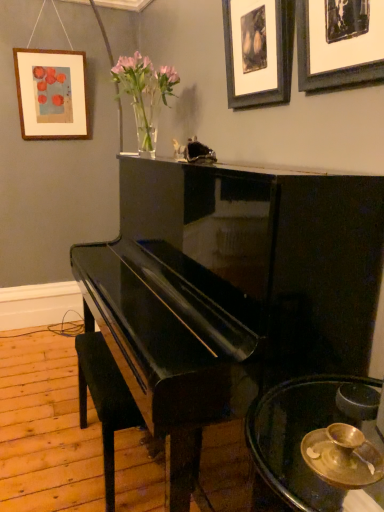
What is the approximate height of translucent glass vase at upper center?

It is 17.48 inches.

Locate an element on the screen. This screenshot has width=384, height=512. black leather music stool at lower left is located at coordinates (105, 400).

How different are the orientations of wooden picture frame at upper center, the 2th picture frame in the front-to-back sequence, and glossy black piano at center in degrees?

0.284 degrees separate the facing orientations of wooden picture frame at upper center, the 2th picture frame in the front-to-back sequence, and glossy black piano at center.

Does wooden picture frame at upper center, which is the 2th picture frame from left to right, turn towards glossy black piano at center?

No, wooden picture frame at upper center, which is the 2th picture frame from left to right, is not facing towards glossy black piano at center.

Is point (283, 42) positioned before point (181, 256)?

Yes, it is in front of point (181, 256).

Is glossy black piano at center located within wooden picture frame at upper center, the 2th picture frame in the front-to-back sequence?

Definitely not — glossy black piano at center is not inside wooden picture frame at upper center, the 2th picture frame in the front-to-back sequence.

Can you confirm if black leather music stool at lower left is smaller than gold metallic bowl at lower right?

No.

From the image's perspective, is black leather music stool at lower left on top of gold metallic bowl at lower right?

Actually, black leather music stool at lower left appears below gold metallic bowl at lower right in the image.

Find the location of a particular element. Image resolution: width=384 pixels, height=512 pixels. table above the black leather music stool at lower left (from the image's perspective) is located at coordinates (301, 438).

Can you confirm if black leather music stool at lower left is shorter than gold metallic bowl at lower right?

No.

In the scene shown: Is black leather music stool at lower left shorter than glossy black piano at center?

Yes, black leather music stool at lower left is shorter than glossy black piano at center.

Is black leather music stool at lower left facing towards glossy black piano at center?

Yes, black leather music stool at lower left is facing glossy black piano at center.

Looking at this image, can you tell me how much black leather music stool at lower left and glossy black piano at center differ in facing direction?

They differ by 0.214 degrees in their facing directions.

Which of these two, wooden picture frame at upper center, which is the 2th picture frame from back to front, or black leather music stool at lower left, is bigger?

black leather music stool at lower left is bigger.

You are a GUI agent. You are given a task and a screenshot of the screen. Output one action in this format:
    pyautogui.click(x=<x>, y=<y>)
    Task: Click on the music stool that appears below the wooden picture frame at upper center, which is the 2th picture frame from left to right (from the image's perspective)
    Image resolution: width=384 pixels, height=512 pixels.
    Given the screenshot: What is the action you would take?
    pyautogui.click(x=105, y=400)

Is black leather music stool at lower left located within wooden picture frame at upper center, which is the 2th picture frame from left to right?

No, black leather music stool at lower left is not a part of wooden picture frame at upper center, which is the 2th picture frame from left to right.

How different are the orientations of wooden picture frame at upper center, which is the 2th picture frame from back to front, and black leather music stool at lower left in degrees?

They differ by 0.0702 degrees in their facing directions.

From a real-world perspective, which object stands above the other?

In real-world perspective, translucent glass vase at upper center is above.

Find the location of a particular element. The image size is (384, 512). floral arrangement lying above the black leather music stool at lower left (from the image's perspective) is located at coordinates (145, 94).

Does translucent glass vase at upper center have a larger size compared to black leather music stool at lower left?

Incorrect, translucent glass vase at upper center is not larger than black leather music stool at lower left.

Is glossy black piano at center to the right of black matte picture frame at upper right, which is the 3th picture frame in back-to-front order, from the viewer's perspective?

In fact, glossy black piano at center is to the left of black matte picture frame at upper right, which is the 3th picture frame in back-to-front order.

Is glossy black piano at center next to black matte picture frame at upper right, which is the 3th picture frame in back-to-front order?

There is a gap between glossy black piano at center and black matte picture frame at upper right, which is the 3th picture frame in back-to-front order.

Locate an element on the screen. picture frame that is the 1st one when counting upward from the glossy black piano at center (from the image's perspective) is located at coordinates (339, 42).

Is glossy black piano at center oriented away from black matte picture frame at upper right, which is the 3th picture frame in back-to-front order?

That's not correct — glossy black piano at center is not looking away from black matte picture frame at upper right, which is the 3th picture frame in back-to-front order.

From the image's perspective, is black matte picture frame at upper right, the first picture frame when ordered from right to left, beneath gold metallic bowl at lower right?

Actually, black matte picture frame at upper right, the first picture frame when ordered from right to left, appears above gold metallic bowl at lower right in the image.

In the scene shown: Considering the relative sizes of black matte picture frame at upper right, which ranks as the 1th picture frame in front-to-back order, and gold metallic bowl at lower right in the image provided, is black matte picture frame at upper right, which ranks as the 1th picture frame in front-to-back order, wider than gold metallic bowl at lower right?

Incorrect, the width of black matte picture frame at upper right, which ranks as the 1th picture frame in front-to-back order, does not surpass that of gold metallic bowl at lower right.

From the picture: Measure the distance from black matte picture frame at upper right, which is the 3th picture frame in back-to-front order, to gold metallic bowl at lower right.

black matte picture frame at upper right, which is the 3th picture frame in back-to-front order, is 35.36 inches from gold metallic bowl at lower right.

Is black matte picture frame at upper right, which is the 3th picture frame in back-to-front order, not near gold metallic bowl at lower right?

No, black matte picture frame at upper right, which is the 3th picture frame in back-to-front order, is not far away from gold metallic bowl at lower right.

I want to click on the 1st picture frame counting from the right of the glossy black piano at center, so click(x=258, y=51).

I want to click on music stool located on the left of gold metallic bowl at lower right, so click(x=105, y=400).

Estimate the real-world distances between objects in this image. Which object is further from wooden picture frame at upper center, the 2th picture frame in the front-to-back sequence, black matte picture frame at upper right, which appears as the 3th picture frame when viewed from the left, or black leather music stool at lower left?

Based on the image, black leather music stool at lower left appears to be further to wooden picture frame at upper center, the 2th picture frame in the front-to-back sequence.

Looking at the image, which one is located further to black leather music stool at lower left, black matte picture frame at upper right, which is the 3th picture frame in back-to-front order, or gold metallic bowl at lower right?

The object further to black leather music stool at lower left is black matte picture frame at upper right, which is the 3th picture frame in back-to-front order.

When comparing their distances from black leather music stool at lower left, does wooden picture frame at upper left, placed as the 1th picture frame when sorted from left to right, or gold metallic bowl at lower right seem closer?

gold metallic bowl at lower right lies closer to black leather music stool at lower left than the other object.

Considering their positions, is black leather music stool at lower left positioned further to glossy black piano at center than wooden picture frame at upper center, marked as the second picture frame in a right-to-left arrangement?

wooden picture frame at upper center, marked as the second picture frame in a right-to-left arrangement, lies further to glossy black piano at center than the other object.

Estimate the real-world distances between objects in this image. Which object is further from wooden picture frame at upper left, placed as the 3th picture frame when sorted from front to back, gold metallic bowl at lower right or black leather music stool at lower left?

gold metallic bowl at lower right lies further to wooden picture frame at upper left, placed as the 3th picture frame when sorted from front to back, than the other object.

When comparing their distances from translucent glass vase at upper center, does black matte picture frame at upper right, which appears as the 3th picture frame when viewed from the left, or gold metallic bowl at lower right seem further?

Among the two, gold metallic bowl at lower right is located further to translucent glass vase at upper center.

From the image, which object appears to be farther from gold metallic bowl at lower right, wooden picture frame at upper left, placed as the 3th picture frame when sorted from front to back, or translucent glass vase at upper center?

Among the two, wooden picture frame at upper left, placed as the 3th picture frame when sorted from front to back, is located further to gold metallic bowl at lower right.

Looking at the image, which one is located further to gold metallic bowl at lower right, wooden picture frame at upper left, the third picture frame in the right-to-left sequence, or wooden picture frame at upper center, the 2th picture frame in the front-to-back sequence?

Based on the image, wooden picture frame at upper left, the third picture frame in the right-to-left sequence, appears to be further to gold metallic bowl at lower right.

Image resolution: width=384 pixels, height=512 pixels. Identify the location of music stool positioned between glossy black piano at center and wooden picture frame at upper left, which is counted as the first picture frame, starting from the back, from near to far. (105, 400).

Locate an element on the screen. piano that lies between wooden picture frame at upper center, marked as the second picture frame in a right-to-left arrangement, and black leather music stool at lower left from top to bottom is located at coordinates (230, 290).

The width and height of the screenshot is (384, 512). What are the coordinates of `floral arrangement located between wooden picture frame at upper center, the 2th picture frame in the front-to-back sequence, and wooden picture frame at upper left, which is counted as the first picture frame, starting from the back, in the depth direction` in the screenshot? It's located at 145,94.

You are a GUI agent. You are given a task and a screenshot of the screen. Output one action in this format:
    pyautogui.click(x=<x>, y=<y>)
    Task: Click on the floral arrangement between wooden picture frame at upper left, placed as the 3th picture frame when sorted from front to back, and black leather music stool at lower left from top to bottom
    The height and width of the screenshot is (512, 384).
    Given the screenshot: What is the action you would take?
    pyautogui.click(x=145, y=94)